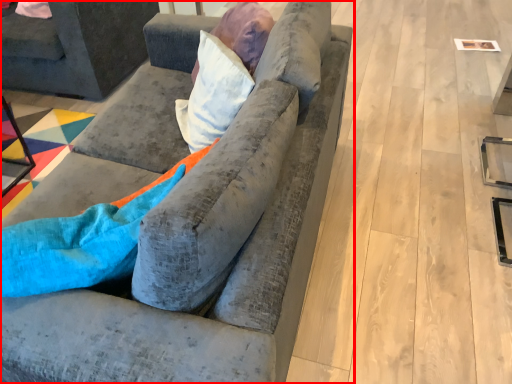
Question: Where is studio couch (annotated by the red box) located in relation to studio couch in the image?

Choices:
 (A) left
 (B) right

Answer: (B)